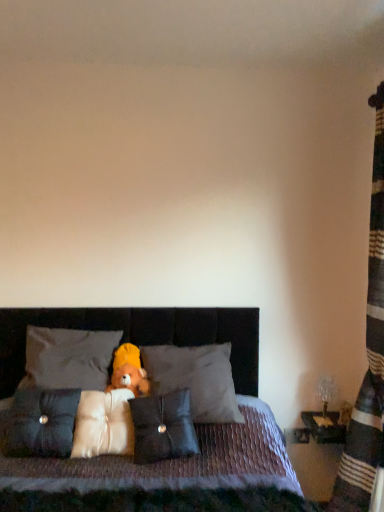
Question: Which direction should I rotate to face white soft pillow at center, arranged as the 3th pillow when viewed from the left, — up or down?

Choices:
 (A) up
 (B) down

Answer: (B)

Question: Considering the relative sizes of dark gray fabric pillow at center, which is counted as the 5th pillow, starting from the left, and white soft pillow at center, arranged as the 3th pillow when viewed from the left, in the image provided, is dark gray fabric pillow at center, which is counted as the 5th pillow, starting from the left, wider than white soft pillow at center, arranged as the 3th pillow when viewed from the left,?

Choices:
 (A) no
 (B) yes

Answer: (B)

Question: Is dark gray fabric pillow at center, placed as the first pillow when sorted from right to left, bigger than white soft pillow at center, arranged as the 3th pillow when viewed from the left?

Choices:
 (A) yes
 (B) no

Answer: (A)

Question: Considering the relative sizes of dark gray fabric pillow at center, which is counted as the 5th pillow, starting from the left, and white soft pillow at center, arranged as the 3th pillow when viewed from the left, in the image provided, is dark gray fabric pillow at center, which is counted as the 5th pillow, starting from the left, shorter than white soft pillow at center, arranged as the 3th pillow when viewed from the left,?

Choices:
 (A) no
 (B) yes

Answer: (A)

Question: From a real-world perspective, does dark gray fabric pillow at center, which is counted as the 5th pillow, starting from the left, sit lower than white soft pillow at center, arranged as the 3th pillow when viewed from the left?

Choices:
 (A) yes
 (B) no

Answer: (B)

Question: Is dark gray fabric pillow at center, placed as the first pillow when sorted from right to left, facing away from white soft pillow at center, positioned as the third pillow in right-to-left order?

Choices:
 (A) no
 (B) yes

Answer: (A)

Question: Can you confirm if dark gray fabric pillow at center, which is counted as the 5th pillow, starting from the left, is thinner than white soft pillow at center, arranged as the 3th pillow when viewed from the left?

Choices:
 (A) yes
 (B) no

Answer: (B)

Question: Is dark gray fabric pillow at center, which is counted as the 5th pillow, starting from the left, at the right side of soft plush teddy bear at center?

Choices:
 (A) no
 (B) yes

Answer: (B)

Question: From the image's perspective, is dark gray fabric pillow at center, which is counted as the 5th pillow, starting from the left, on soft plush teddy bear at center?

Choices:
 (A) no
 (B) yes

Answer: (A)

Question: Is dark gray fabric pillow at center, placed as the first pillow when sorted from right to left, not close to soft plush teddy bear at center?

Choices:
 (A) yes
 (B) no

Answer: (B)

Question: From a real-world perspective, is dark gray fabric pillow at center, which is counted as the 5th pillow, starting from the left, beneath soft plush teddy bear at center?

Choices:
 (A) no
 (B) yes

Answer: (B)

Question: From the image's perspective, is dark gray fabric pillow at center, placed as the first pillow when sorted from right to left, beneath soft plush teddy bear at center?

Choices:
 (A) no
 (B) yes

Answer: (B)

Question: Is dark gray fabric pillow at center, which is counted as the 5th pillow, starting from the left, smaller than soft plush teddy bear at center?

Choices:
 (A) yes
 (B) no

Answer: (B)

Question: Is velvet-like brown bed at center positioned behind dark gray fabric pillow at center, placed as the first pillow when sorted from right to left?

Choices:
 (A) yes
 (B) no

Answer: (B)